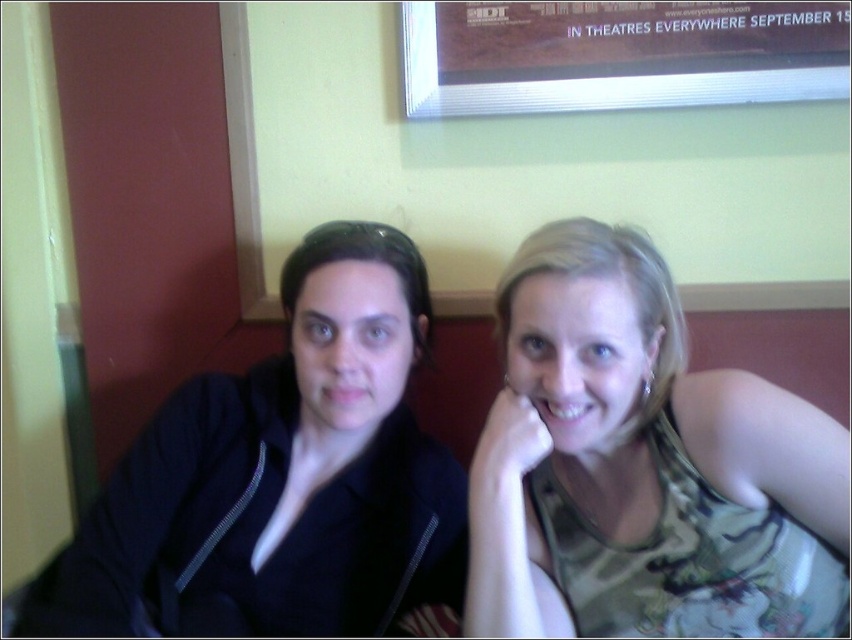
Question: Is camouflage tank top at center above matte black mouth at center?

Choices:
 (A) yes
 (B) no

Answer: (B)

Question: Is camouflage tank top at center below white glossy teeth at center?

Choices:
 (A) no
 (B) yes

Answer: (B)

Question: From the image, what is the correct spatial relationship of black matte jacket at left in relation to matte black mouth at center?

Choices:
 (A) below
 (B) above

Answer: (A)

Question: Which object is positioned farthest from the white glossy teeth at center?

Choices:
 (A) black matte jacket at left
 (B) camouflage tank top at center

Answer: (A)

Question: Which of these objects is positioned closest to the camouflage tank top at center?

Choices:
 (A) white glossy teeth at center
 (B) matte black mouth at center

Answer: (A)

Question: Which object is farther from the camera taking this photo?

Choices:
 (A) black matte jacket at left
 (B) camouflage tank top at center

Answer: (A)